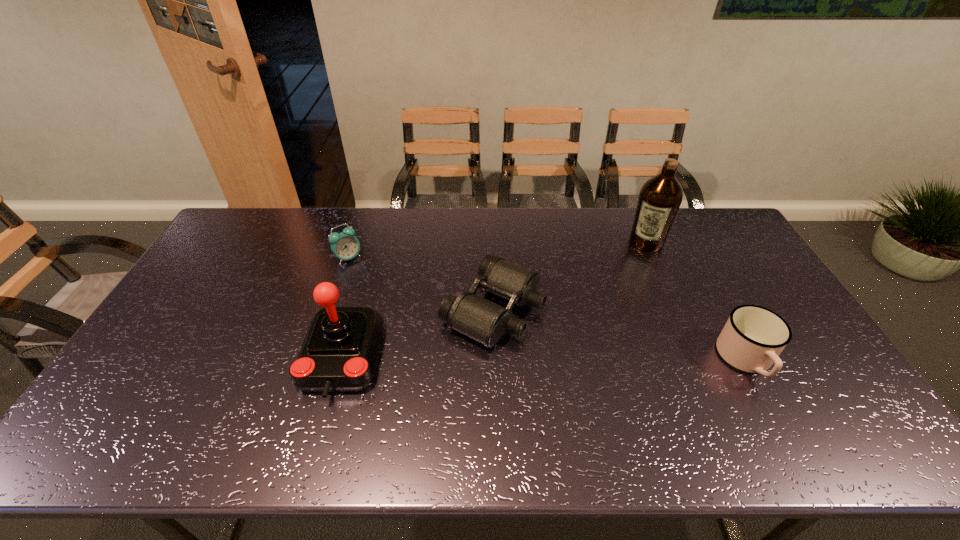
Identify the location of the second tallest object. The width and height of the screenshot is (960, 540). (339, 352).

Locate an element on the screen. This screenshot has width=960, height=540. mug is located at coordinates (753, 337).

I want to click on the tallest object, so click(x=660, y=197).

Locate an element on the screen. The image size is (960, 540). binoculars is located at coordinates (478, 318).

Identify the location of alarm clock. (344, 245).

The image size is (960, 540). In order to click on vacant region located on the label of the tallest object in this screenshot , I will do `click(610, 320)`.

This screenshot has height=540, width=960. Find the location of `blank space located on the label of the tallest object`. blank space located on the label of the tallest object is located at coordinates (634, 269).

What are the coordinates of `vacant point located on the label of the tallest object` in the screenshot? It's located at (609, 322).

Identify the location of vacant space located 0.100m through the eyepieces of the third object from left to right. Image resolution: width=960 pixels, height=540 pixels. (572, 347).

This screenshot has width=960, height=540. What are the coordinates of `vacant space located through the eyepieces of the third object from left to right` in the screenshot? It's located at (647, 382).